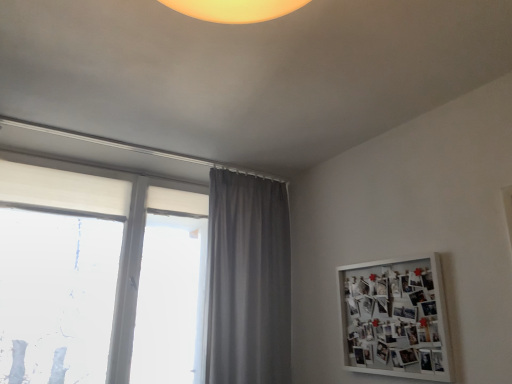
Question: Is white matte bulletin board at upper right wider than white matte window at left?

Choices:
 (A) yes
 (B) no

Answer: (B)

Question: Considering the relative positions of white matte bulletin board at upper right and white matte window at left in the image provided, is white matte bulletin board at upper right to the left of white matte window at left from the viewer's perspective?

Choices:
 (A) no
 (B) yes

Answer: (A)

Question: Is white matte bulletin board at upper right bigger than white matte window at left?

Choices:
 (A) no
 (B) yes

Answer: (A)

Question: Does white matte bulletin board at upper right have a smaller size compared to white matte window at left?

Choices:
 (A) no
 (B) yes

Answer: (B)

Question: From the image's perspective, is white matte bulletin board at upper right above white matte window at left?

Choices:
 (A) no
 (B) yes

Answer: (A)

Question: Is white matte bulletin board at upper right positioned before white matte window at left?

Choices:
 (A) no
 (B) yes

Answer: (B)

Question: From the image's perspective, is white matte bulletin board at upper right under gray fabric curtain at center?

Choices:
 (A) no
 (B) yes

Answer: (B)

Question: From the image's perspective, is white matte bulletin board at upper right above gray fabric curtain at center?

Choices:
 (A) no
 (B) yes

Answer: (A)

Question: From a real-world perspective, is white matte bulletin board at upper right positioned over gray fabric curtain at center based on gravity?

Choices:
 (A) no
 (B) yes

Answer: (A)

Question: Is white matte bulletin board at upper right touching gray fabric curtain at center?

Choices:
 (A) no
 (B) yes

Answer: (A)

Question: Can you confirm if white matte bulletin board at upper right is positioned to the right of gray fabric curtain at center?

Choices:
 (A) no
 (B) yes

Answer: (B)

Question: Can you confirm if white matte bulletin board at upper right is bigger than gray fabric curtain at center?

Choices:
 (A) yes
 (B) no

Answer: (B)

Question: Can you confirm if white matte window at left is shorter than white matte bulletin board at upper right?

Choices:
 (A) yes
 (B) no

Answer: (B)